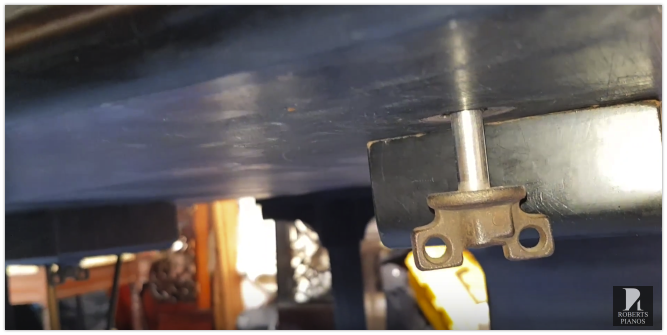
This screenshot has height=335, width=667. I want to click on chair leg, so click(55, 320).